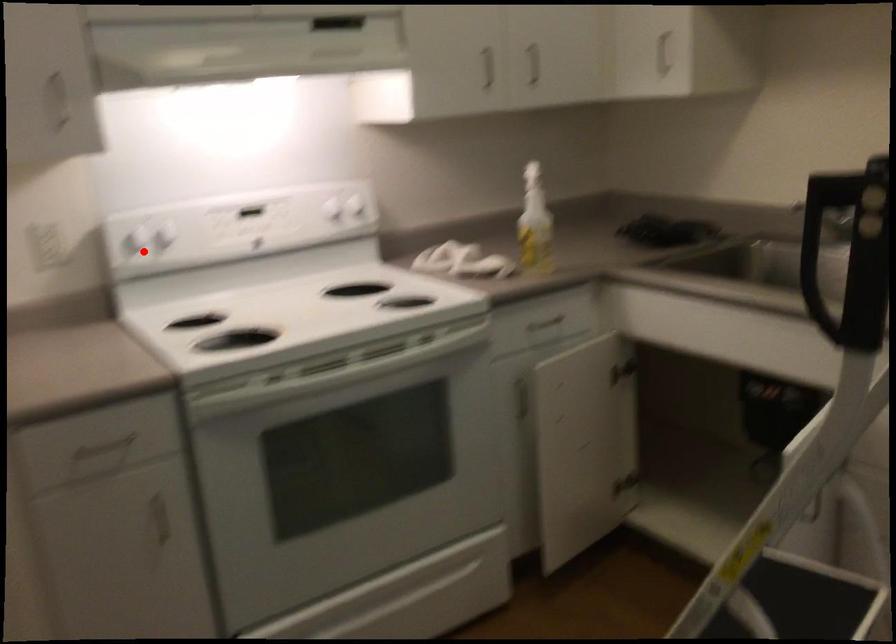
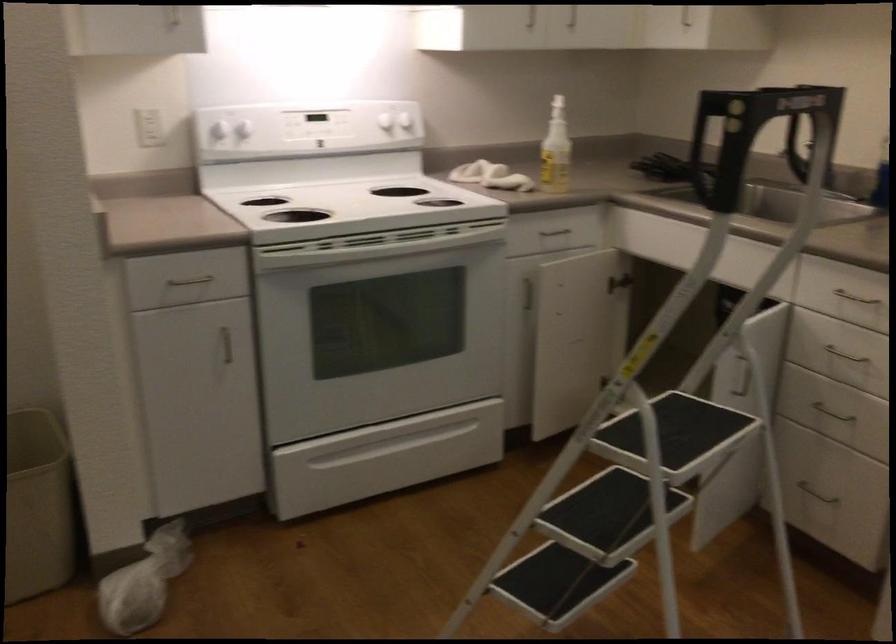
Find the pixel in the second image that matches the highlighted location in the first image.

(221, 133)